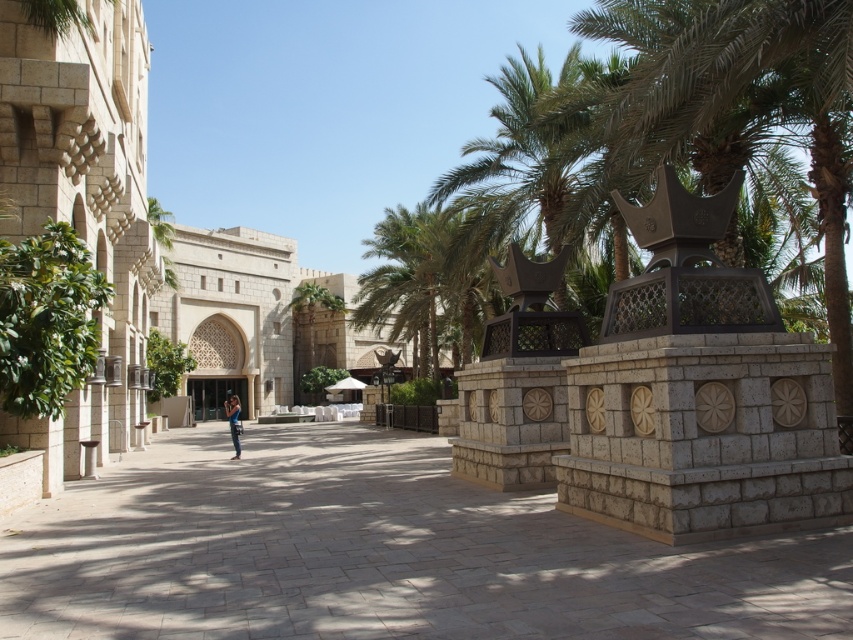
Measure the distance between point (358, 353) and camera.

Point (358, 353) is 69.29 meters from camera.

This screenshot has width=853, height=640. What are the coordinates of `beige stone palace at center` in the screenshot? It's located at (258, 321).

Is beige stone palace at center below blue denim jeans at center?

No, beige stone palace at center is not below blue denim jeans at center.

Does beige stone palace at center have a larger size compared to blue denim jeans at center?

Correct, beige stone palace at center is larger in size than blue denim jeans at center.

Is point (239, 330) more distant than point (238, 449)?

That is True.

Where is `beige stone palace at center`? The image size is (853, 640). beige stone palace at center is located at coordinates (258, 321).

Is point (538, 612) closer to viewer compared to point (231, 438)?

Yes, point (538, 612) is closer to viewer.

Between paved stone path at center and blue denim jeans at center, which one is positioned higher?

paved stone path at center is above.

The width and height of the screenshot is (853, 640). I want to click on paved stone path at center, so click(x=378, y=554).